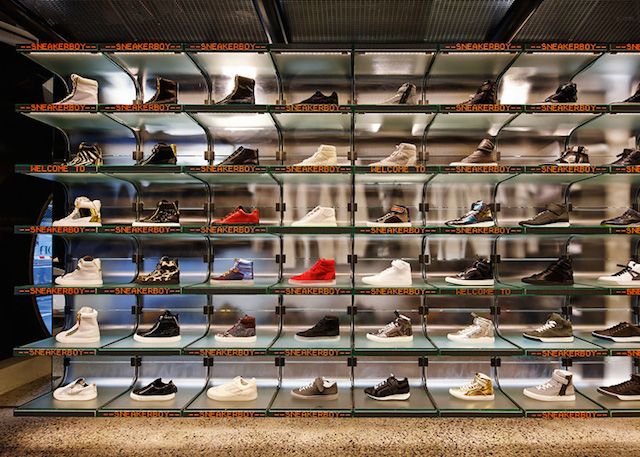
At what (x,y) coordinates should I click in order to perform the action: click on 6th shelve. Please return your answer as a coordinate pair (x, y). This screenshot has width=640, height=457. Looking at the image, I should click on (59, 105), (173, 110), (227, 107), (308, 108), (384, 109), (468, 109), (540, 108), (627, 107).